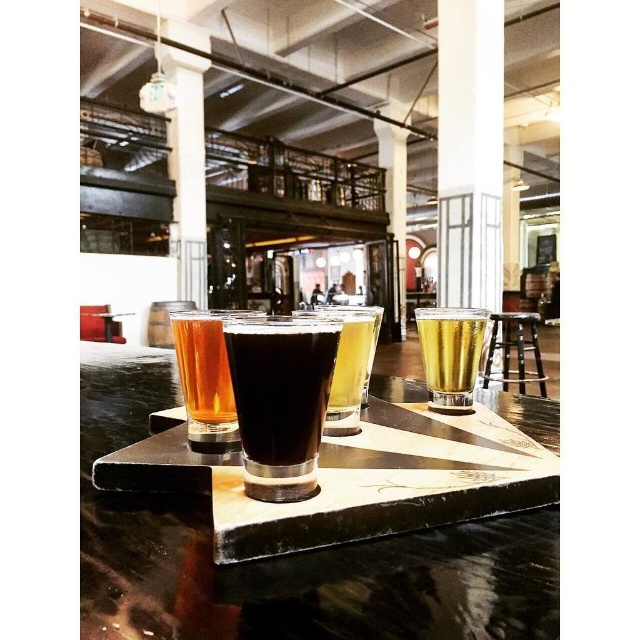
You are a bartender trying to place a new beer glass on the tray. The tray is at point [285,557]. Where should you place the new glass to ensure it stays on the tray?

Place the new glass on the black marble tray at center marked by point [285,557] to ensure it stays on the tray.

You are a bartender trying to place a coaster under the dark glass at center and the translucent glass at center. Which glass requires a smaller coaster?

The dark glass at center requires a smaller coaster because it is smaller than the translucent glass at center.

You are a bartender arranging drinks on a triangular tray. You have a dark glass at center and a translucent glass at center. Which one is more to the left?

The dark glass at center is more to the left side of the translucent glass at center.